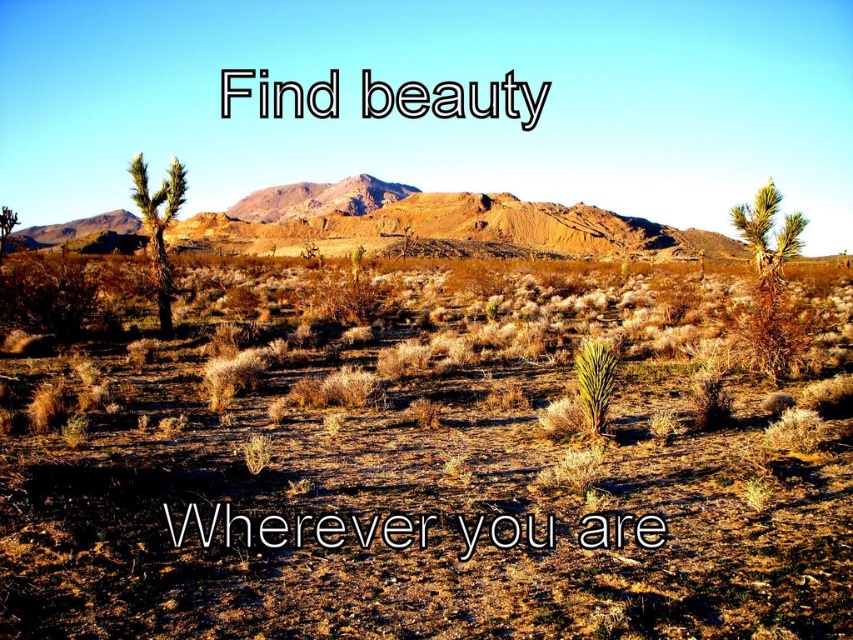
You are a hiker standing at the base of the desert landscape shown in the image. You want to take a photo of the brown rocky mountain at center from a position that aligns with the coordinates provided. Where should you position yourself relative to the mountain to capture it in the frame?

The brown rocky mountain at center is located at coordinates point (440, 221). To capture it in your photo, position yourself directly in front of the mountain at the specified coordinates.

You are a hiker planning to take a photo of the brown rocky mountain at center and the green spiky cactus at right. Which object should you focus on first if you want both to be in sharp focus?

You should focus on the brown rocky mountain at center first because it is closer to you than the green spiky cactus at right. This way, both will be in focus as the cactus is behind the mountain.